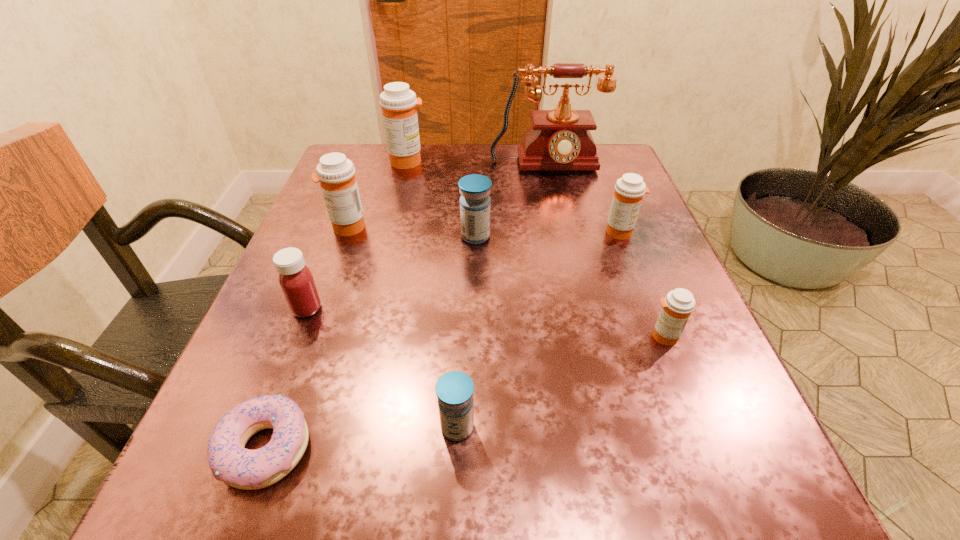
Identify the location of vacant space situated 0.170m on the front of the third nearest medicine. (264, 417).

This screenshot has width=960, height=540. Find the location of `vacant space located 0.080m on the front of the seventh farthest object`. vacant space located 0.080m on the front of the seventh farthest object is located at coordinates (685, 394).

You are a GUI agent. You are given a task and a screenshot of the screen. Output one action in this format:
    pyautogui.click(x=<x>, y=<y>)
    Task: Click on the vacant space situated on the back of the smaller blue medicine
    
    Given the screenshot: What is the action you would take?
    pyautogui.click(x=465, y=241)

This screenshot has height=540, width=960. Find the location of `vacant space situated on the back of the pink doughnut`. vacant space situated on the back of the pink doughnut is located at coordinates (315, 313).

I want to click on telephone located in the far edge section of the desktop, so click(559, 139).

Locate an element on the screen. medicine located in the far edge section of the desktop is located at coordinates (398, 103).

I want to click on object that is positioned at the near edge, so click(x=229, y=460).

Find the location of `doughnut at the left edge`. doughnut at the left edge is located at coordinates (229, 460).

Locate an element on the screen. The image size is (960, 540). telephone positioned at the right edge is located at coordinates (559, 139).

The image size is (960, 540). I want to click on object present at the far left corner, so [x=398, y=103].